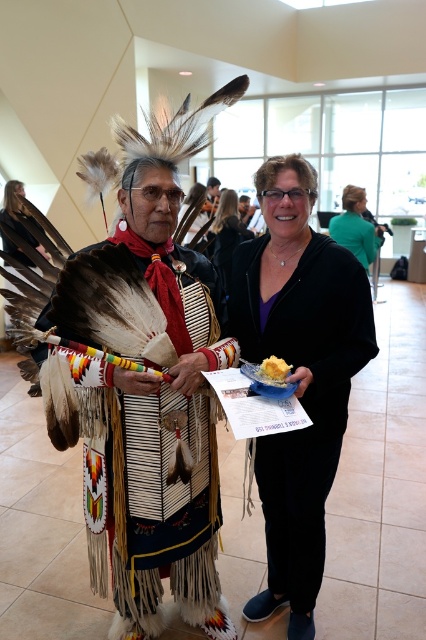
Who is taller, matte black plate at center or matte black jacket at center?

matte black plate at center is taller.

Is point (291, 330) positioned in front of point (178, 237)?

Yes, point (291, 330) is in front of point (178, 237).

Where is `matte black plate at center`? matte black plate at center is located at coordinates (302, 396).

Is matte black jacket at center thinner than yellow fluffy bread at center?

In fact, matte black jacket at center might be wider than yellow fluffy bread at center.

Which is more to the right, matte black jacket at center or yellow fluffy bread at center?

yellow fluffy bread at center is more to the right.

Does point (181, 204) lie in front of point (268, 371)?

No, it is behind (268, 371).

At what (x,y) coordinates should I click in order to perform the action: click on matte black jacket at center. Please return your answer as a coordinate pair (x, y). The image size is (426, 640). Looking at the image, I should click on (192, 214).

Does green fabric jacket at center have a smaller size compared to yellow fluffy bread at center?

No, green fabric jacket at center is not smaller than yellow fluffy bread at center.

Where is `green fabric jacket at center`? This screenshot has width=426, height=640. green fabric jacket at center is located at coordinates (356, 227).